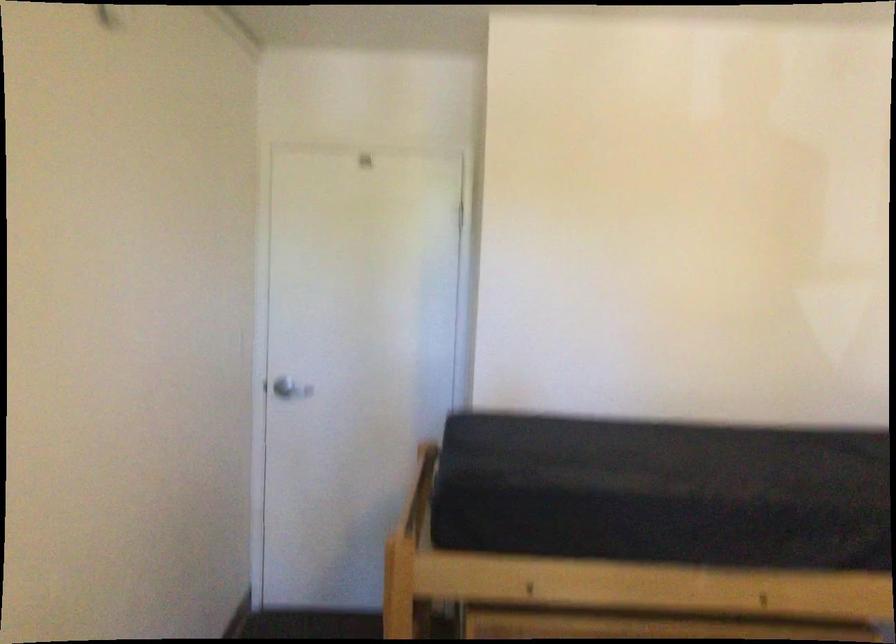
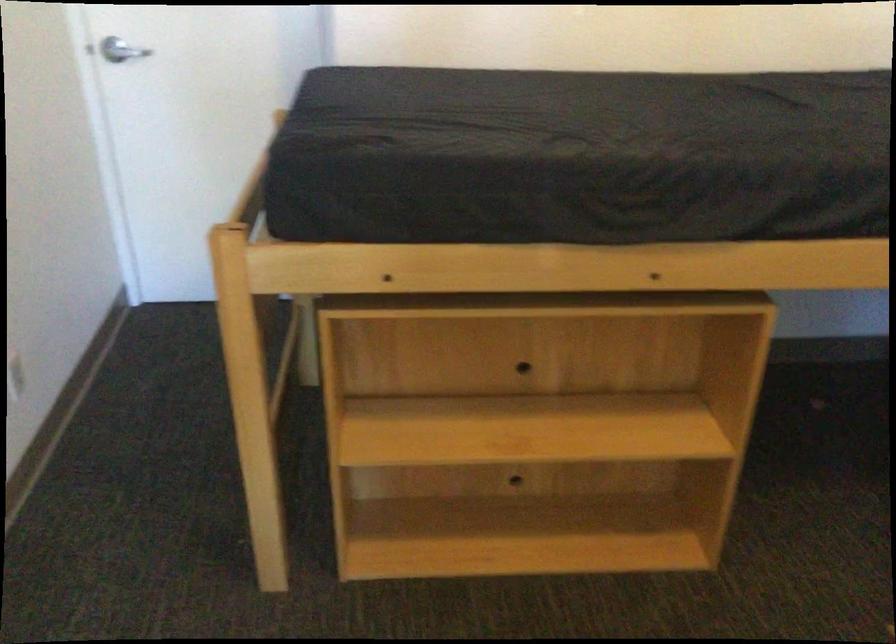
In a continuous first-person perspective shot, in which direction is the camera moving?

The cameraman walked toward right, forward.